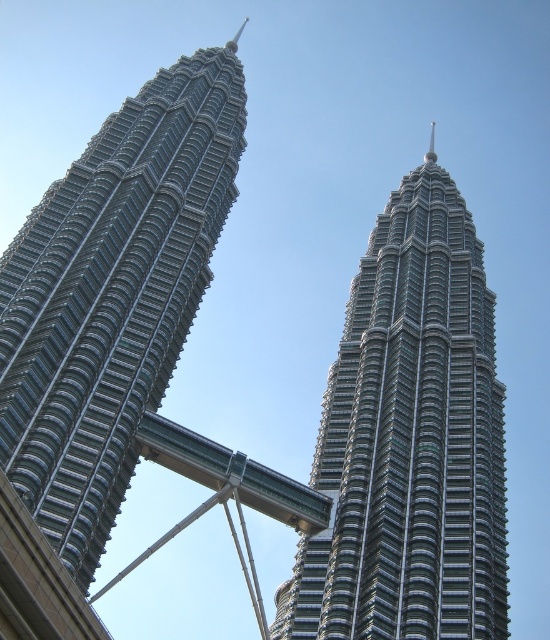
Question: Which point appears closest to the camera in this image?

Choices:
 (A) (35, 244)
 (B) (360, 566)

Answer: (B)

Question: Which of the following is the farthest from the observer?

Choices:
 (A) (50, 429)
 (B) (364, 509)

Answer: (B)

Question: Can you confirm if metallic glass skyscraper at center is positioned above shiny metallic skyscraper at center?

Choices:
 (A) yes
 (B) no

Answer: (B)

Question: Is metallic glass skyscraper at center positioned behind shiny metallic skyscraper at center?

Choices:
 (A) no
 (B) yes

Answer: (B)

Question: Can you confirm if metallic glass skyscraper at center is wider than shiny metallic skyscraper at center?

Choices:
 (A) no
 (B) yes

Answer: (B)